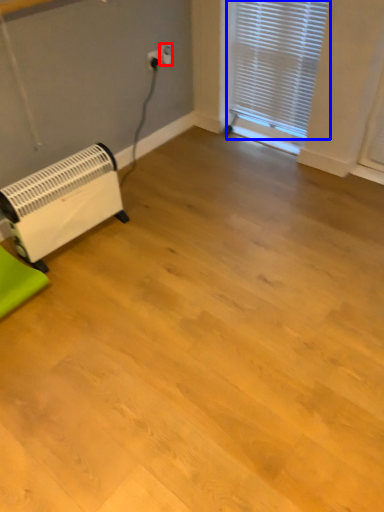
Question: Which object is closer to the camera taking this photo, electric outlet (highlighted by a red box) or window blind (highlighted by a blue box)?

Choices:
 (A) electric outlet
 (B) window blind

Answer: (B)